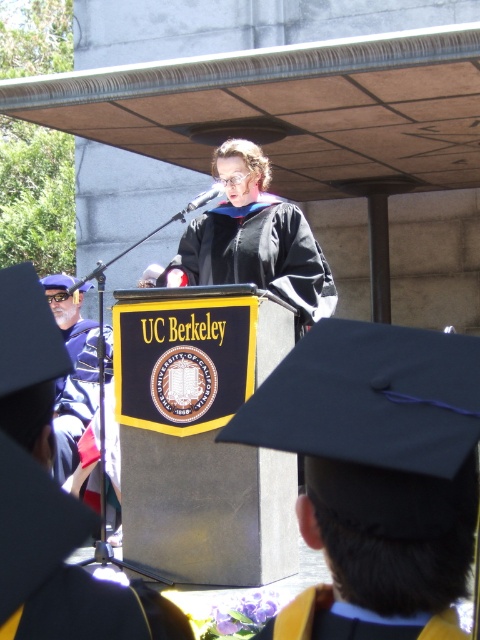
Question: Does matte black graduation gown at center appear over matte black graduation gown at left?

Choices:
 (A) yes
 (B) no

Answer: (A)

Question: Which point is closer to the camera taking this photo?

Choices:
 (A) (223, 237)
 (B) (86, 397)
 (C) (384, 634)

Answer: (C)

Question: Among these objects, which one is farthest from the camera?

Choices:
 (A) matte black graduation gown at center
 (B) matte black graduation gown at left

Answer: (B)

Question: Does matte black graduation gown at left appear on the right side of yellow matte graduation gown at lower center?

Choices:
 (A) no
 (B) yes

Answer: (A)

Question: Does matte black graduation gown at left have a smaller size compared to yellow matte graduation gown at lower center?

Choices:
 (A) yes
 (B) no

Answer: (B)

Question: Which object appears farthest from the camera in this image?

Choices:
 (A) yellow matte graduation gown at lower center
 (B) matte black graduation gown at left

Answer: (B)